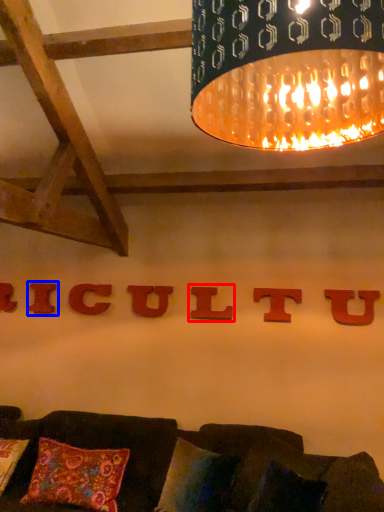
Question: Which object is closer to the camera taking this photo, alphabet (highlighted by a red box) or alphabet (highlighted by a blue box)?

Choices:
 (A) alphabet
 (B) alphabet

Answer: (A)